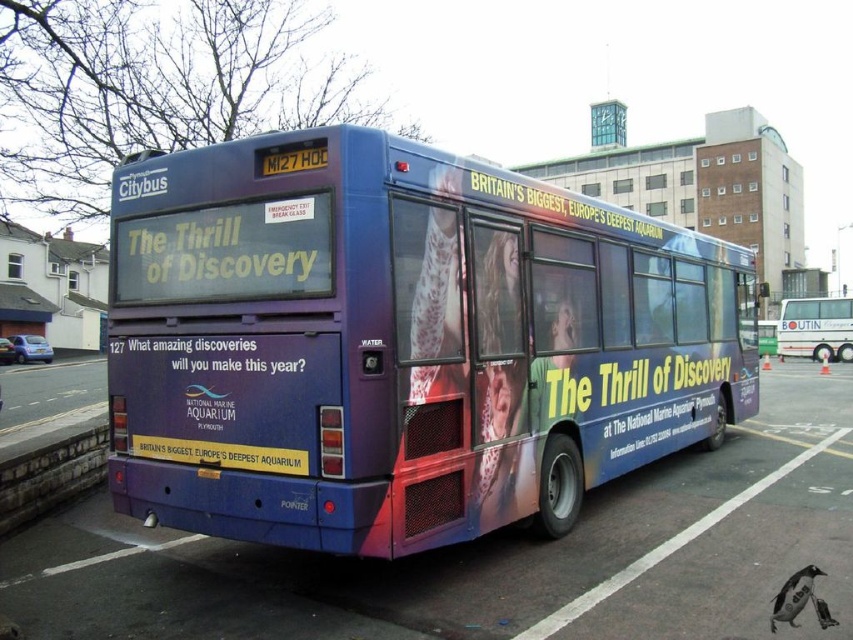
Question: Is matte purple bus at center to the right of matte white bus at center from the viewer's perspective?

Choices:
 (A) no
 (B) yes

Answer: (A)

Question: Estimate the real-world distances between objects in this image. Which object is farther from the metallic blue bus at center?

Choices:
 (A) matte purple bus at center
 (B) matte white bus at center

Answer: (B)

Question: Observing the image, what is the correct spatial positioning of metallic blue bus at center in reference to matte white bus at center?

Choices:
 (A) above
 (B) below

Answer: (B)

Question: Which point is closer to the camera taking this photo?

Choices:
 (A) (838, 340)
 (B) (531, 580)

Answer: (B)

Question: Where is matte purple bus at center located in relation to metallic blue bus at center in the image?

Choices:
 (A) below
 (B) above

Answer: (B)

Question: Which object is positioned closest to the matte white bus at center?

Choices:
 (A) matte purple bus at center
 (B) metallic blue bus at center

Answer: (B)